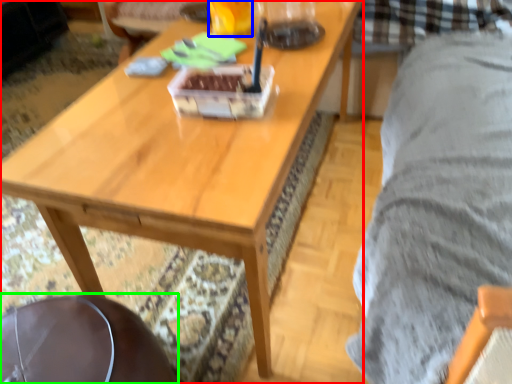
Question: Which is farther away from coffee table (highlighted by a red box)? beverage (highlighted by a blue box) or swivel chair (highlighted by a green box)?

Choices:
 (A) beverage
 (B) swivel chair

Answer: (A)